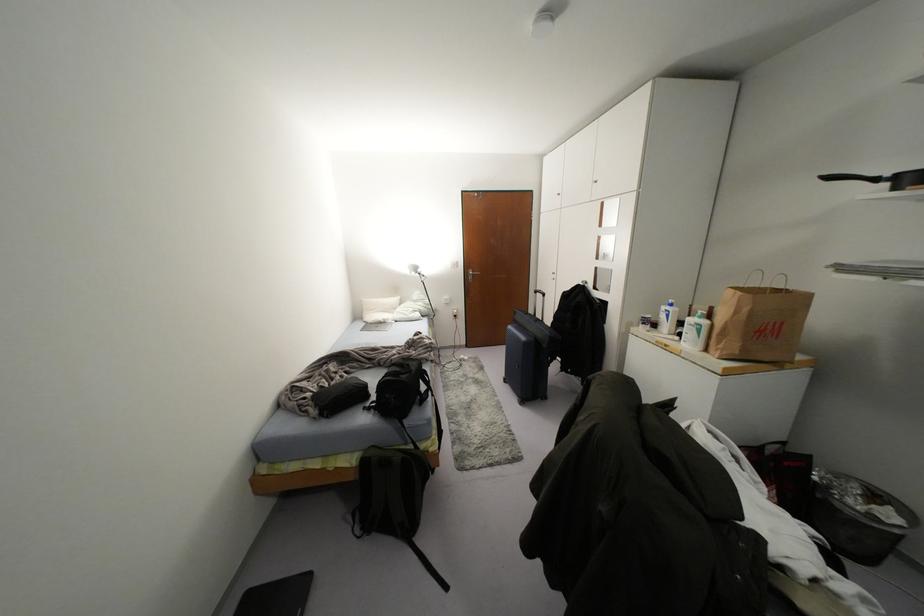
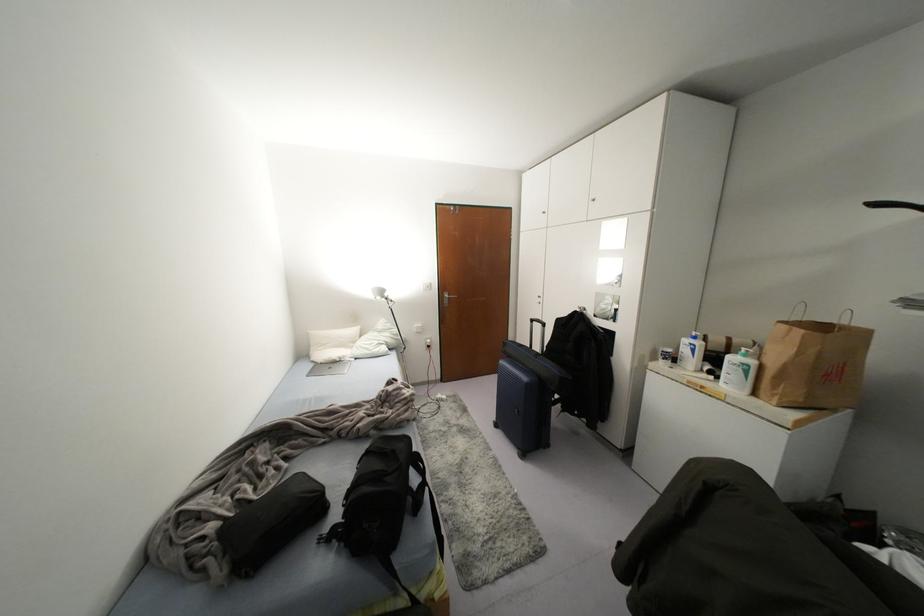
Locate, in the second image, the point that corresponds to the point at 703,322 in the first image.

(751, 362)